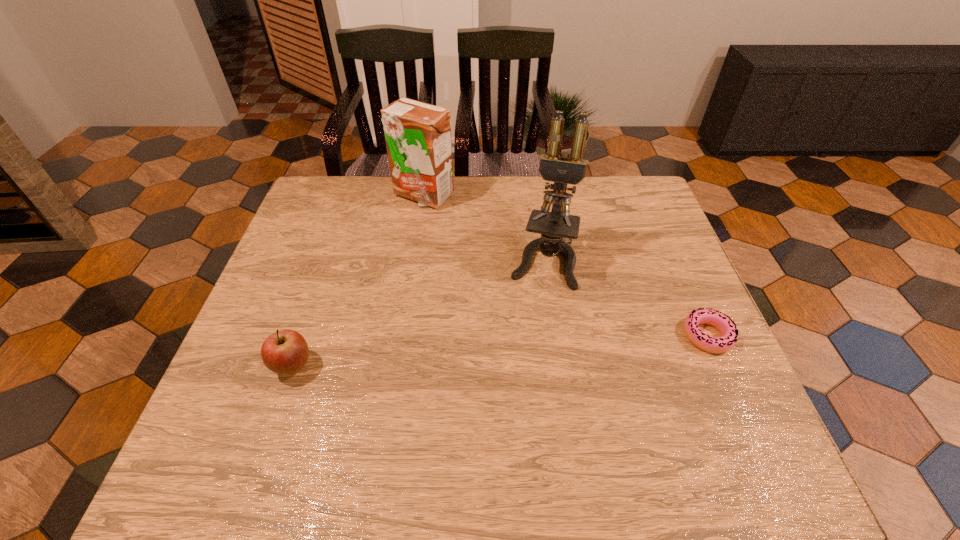
At what (x,y) coordinates should I click in order to perform the action: click on free space located at the eyepieces of the microscope. Please return your answer as a coordinate pair (x, y). The image size is (960, 540). Looking at the image, I should click on (529, 334).

Find the location of `free spot located 0.280m at the eyepieces of the microscope`. free spot located 0.280m at the eyepieces of the microscope is located at coordinates (517, 386).

Where is `vacant area situated at the eyepieces of the microscope`? This screenshot has height=540, width=960. vacant area situated at the eyepieces of the microscope is located at coordinates (512, 413).

Locate an element on the screen. vacant area situated 0.080m on the straw side of the farthest object is located at coordinates (431, 227).

Image resolution: width=960 pixels, height=540 pixels. I want to click on blank space located on the straw side of the farthest object, so click(432, 230).

Locate an element on the screen. This screenshot has height=540, width=960. free space located 0.290m on the straw side of the farthest object is located at coordinates (443, 279).

In order to click on object that is at the far edge in this screenshot , I will do `click(418, 135)`.

Identify the location of object that is at the near edge. (285, 352).

Where is `object situated at the left edge`? Image resolution: width=960 pixels, height=540 pixels. object situated at the left edge is located at coordinates (285, 352).

This screenshot has width=960, height=540. In order to click on object that is at the right edge in this screenshot , I will do `click(722, 322)`.